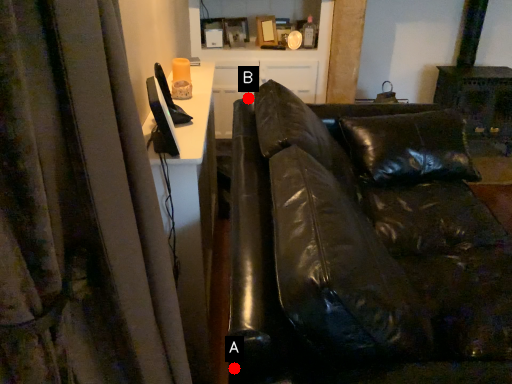
Question: Two points are circled on the image, labeled by A and B beside each circle. Among these points, which one is farthest from the camera?

Choices:
 (A) A is further
 (B) B is further

Answer: (B)